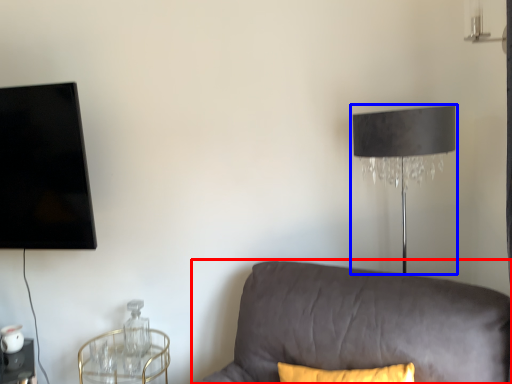
Question: Which object appears farthest to the camera in this image, studio couch (highlighted by a red box) or lamp (highlighted by a blue box)?

Choices:
 (A) studio couch
 (B) lamp

Answer: (B)